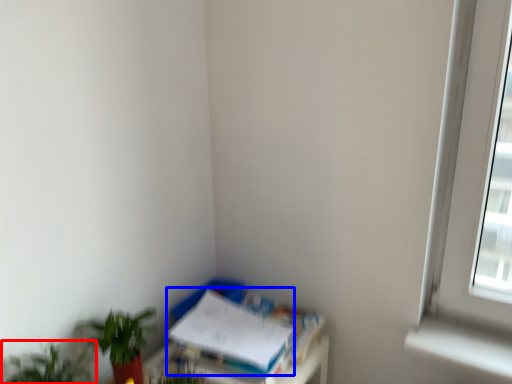
Question: Which object appears farthest to the camera in this image, houseplant (highlighted by a red box) or paperback book (highlighted by a blue box)?

Choices:
 (A) houseplant
 (B) paperback book

Answer: (B)